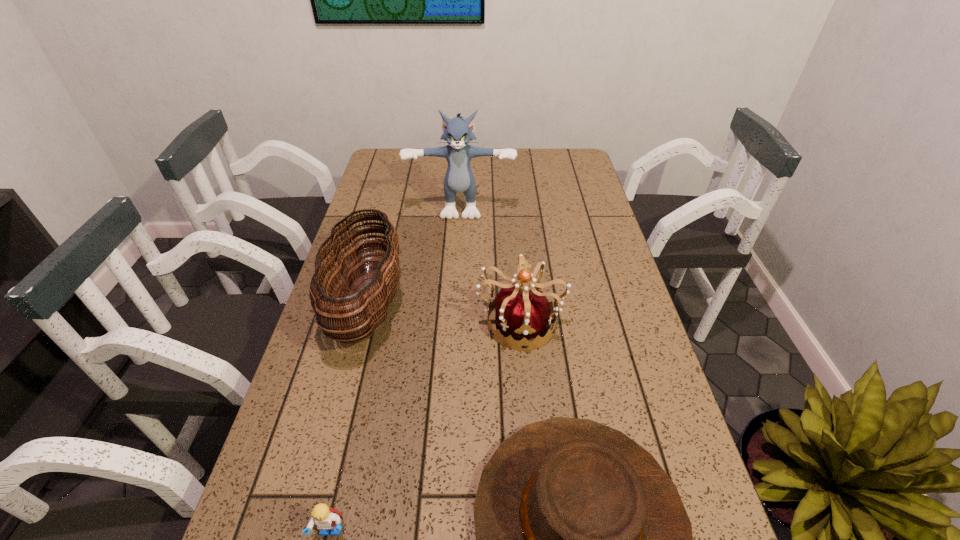
The height and width of the screenshot is (540, 960). What are the coordinates of `vacant space that's between the tiara and the cat` in the screenshot? It's located at (491, 263).

Identify which object is located as the third nearest to the tiara. Please provide its 2D coordinates. Your answer should be formatted as a tuple, i.e. [(x, y)], where the tuple contains the x and y coordinates of a point satisfying the conditions above.

[(459, 177)]

You are a GUI agent. You are given a task and a screenshot of the screen. Output one action in this format:
    pyautogui.click(x=<x>, y=<y>)
    Task: Click on the object that is the fourth nearest to the basket
    
    Given the screenshot: What is the action you would take?
    pyautogui.click(x=326, y=518)